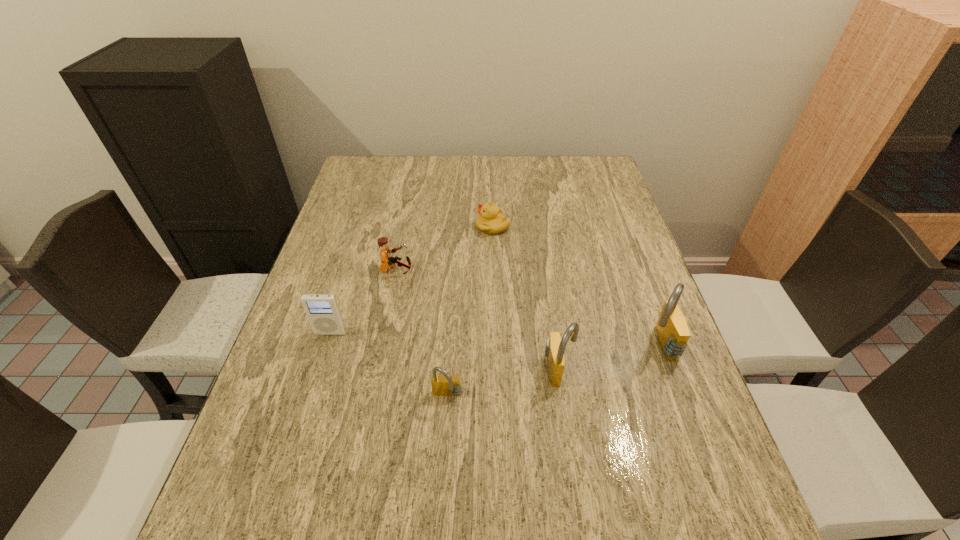
You are a GUI agent. You are given a task and a screenshot of the screen. Output one action in this format:
    pyautogui.click(x=<x>, y=<y>)
    Task: Click on the Lego
    The width and height of the screenshot is (960, 540).
    Given the screenshot: What is the action you would take?
    pyautogui.click(x=385, y=251)

Locate an element on the screen. This screenshot has height=540, width=960. vacant area located on the side with the combination dials of the nearest padlock is located at coordinates tap(444, 463).

Locate an element on the screen. Image resolution: width=960 pixels, height=540 pixels. blank space located on the side with the combination dials of the fifth object from left to right is located at coordinates (656, 369).

Where is `vacant area situated on the side with the combination dials of the rightmost object`? This screenshot has height=540, width=960. vacant area situated on the side with the combination dials of the rightmost object is located at coordinates (601, 345).

Where is `vacant space located 0.240m on the side with the combination dials of the rightmost object`? Image resolution: width=960 pixels, height=540 pixels. vacant space located 0.240m on the side with the combination dials of the rightmost object is located at coordinates (540, 345).

The height and width of the screenshot is (540, 960). What are the coordinates of `vacant space situated 0.130m on the side with the combination dials of the rightmost object` in the screenshot? It's located at [588, 345].

The width and height of the screenshot is (960, 540). Find the location of `vacant space located 0.280m on the front-facing side of the farthest object`. vacant space located 0.280m on the front-facing side of the farthest object is located at coordinates (382, 226).

Locate an element on the screen. This screenshot has width=960, height=540. vacant space situated 0.060m on the front-facing side of the farthest object is located at coordinates (455, 226).

This screenshot has height=540, width=960. What are the coordinates of `blank space located on the front-facing side of the farthest object` in the screenshot? It's located at pos(358,226).

At what (x,y) coordinates should I click in order to perform the action: click on free space located 0.080m on the front-facing side of the leftmost object. Please return your answer as a coordinate pair (x, y). The width and height of the screenshot is (960, 540). Looking at the image, I should click on (321, 364).